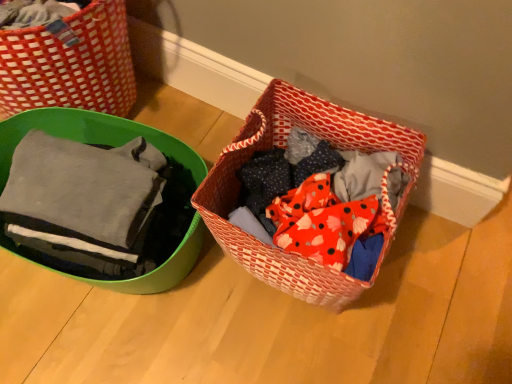
At what (x,y) coordinates should I click in order to perform the action: click on vacant space to the right of red woven basket at center, the second picnic basket positioned from the left. Please return your answer as a coordinate pair (x, y). This screenshot has width=512, height=384. Looking at the image, I should click on click(440, 278).